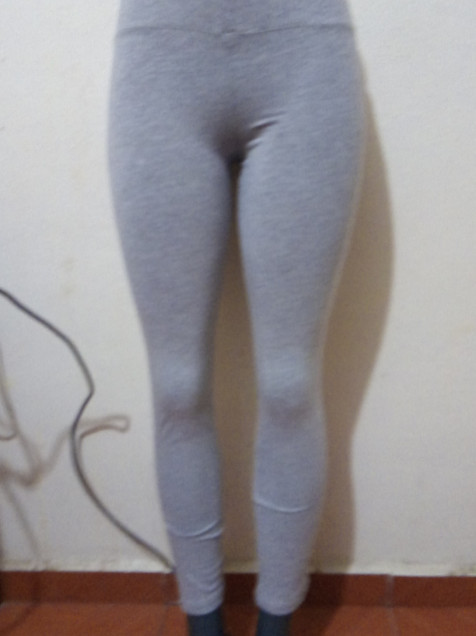
This screenshot has height=636, width=476. I want to click on white wall, so click(427, 396).